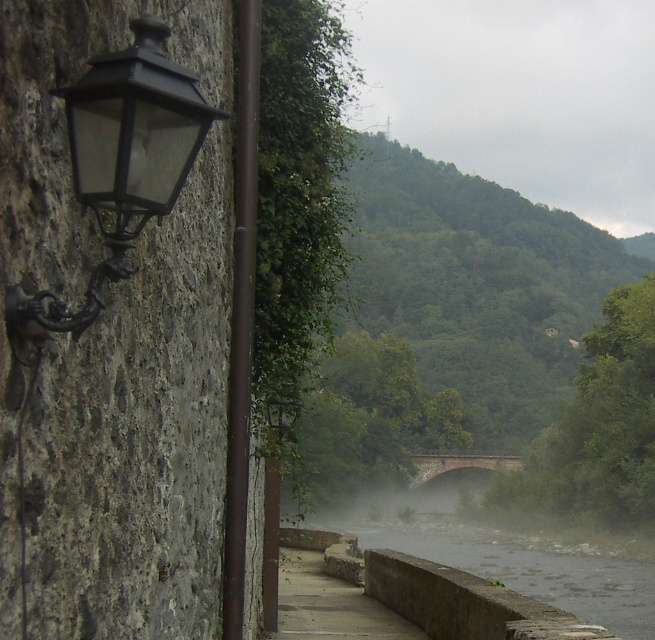
Question: Which point appears closest to the camera in this image?

Choices:
 (A) (487, 458)
 (B) (170, 106)

Answer: (B)

Question: Is matte black lantern at left above red brick bridge at center?

Choices:
 (A) yes
 (B) no

Answer: (A)

Question: Can you confirm if matte black lantern at left is positioned to the right of red brick bridge at center?

Choices:
 (A) no
 (B) yes

Answer: (A)

Question: Among these points, which one is farthest from the camera?

Choices:
 (A) (489, 458)
 (B) (147, 145)

Answer: (A)

Question: From the image, what is the correct spatial relationship of matte black lantern at left in relation to red brick bridge at center?

Choices:
 (A) left
 (B) right

Answer: (A)

Question: Which of the following is the farthest from the observer?

Choices:
 (A) red brick bridge at center
 (B) matte black lantern at left

Answer: (A)